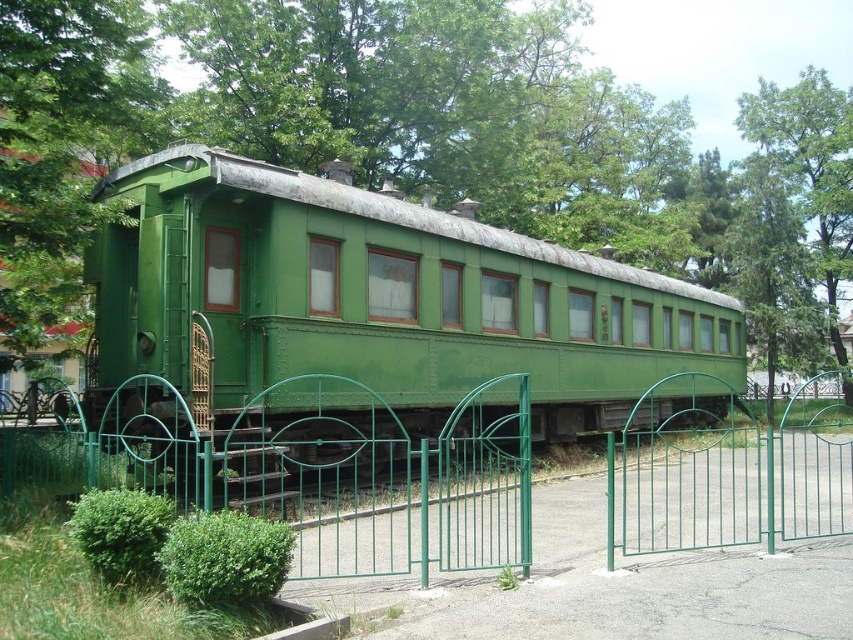
Locate an element on the screen. The width and height of the screenshot is (853, 640). green matte train car at center is located at coordinates (370, 308).

Is point (302, 333) closer to camera compared to point (798, 90)?

Yes, point (302, 333) is closer to viewer.

Locate an element on the screen. The height and width of the screenshot is (640, 853). green matte train car at center is located at coordinates pos(370,308).

The image size is (853, 640). Describe the element at coordinates (465, 129) in the screenshot. I see `green matte tree at upper center` at that location.

Can you confirm if green matte tree at upper center is bigger than green leafy tree at upper right?

Correct, green matte tree at upper center is larger in size than green leafy tree at upper right.

The width and height of the screenshot is (853, 640). What do you see at coordinates (465, 129) in the screenshot?
I see `green matte tree at upper center` at bounding box center [465, 129].

The height and width of the screenshot is (640, 853). I want to click on green matte tree at upper center, so click(x=465, y=129).

Is green matte tree at upper center positioned at the back of green metal gate at center?

Yes, it is.

Does point (764, 145) lie in front of point (131, 472)?

No, (764, 145) is further to viewer.

Is point (822, 160) positioned before point (260, 499)?

That is False.

Image resolution: width=853 pixels, height=640 pixels. Find the location of `green matte tree at upper center`. green matte tree at upper center is located at coordinates (465, 129).